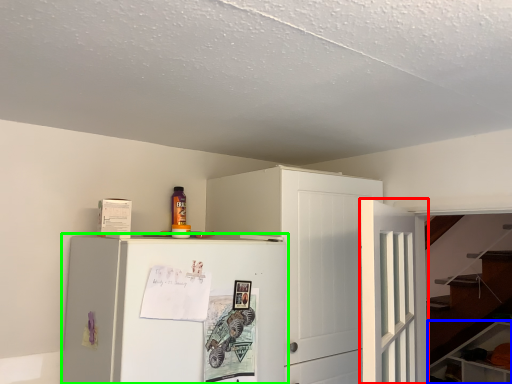
Question: Which is farther away from door (highlighted by a red box)? cabinetry (highlighted by a blue box) or refrigerator (highlighted by a green box)?

Choices:
 (A) cabinetry
 (B) refrigerator

Answer: (A)